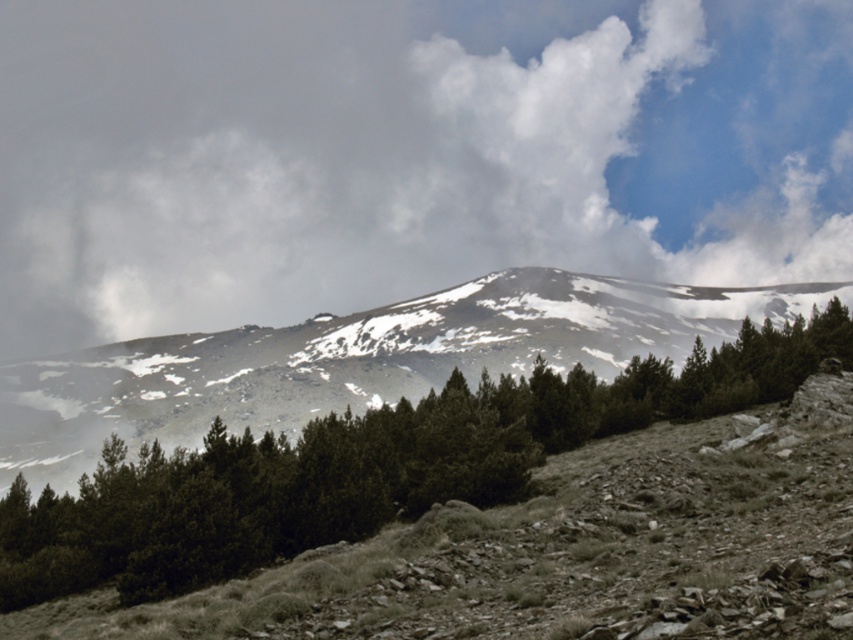
Who is more forward, (254, 196) or (495, 403)?

Positioned in front is point (495, 403).

Who is more distant from viewer, (x=509, y=93) or (x=189, y=544)?

Point (x=509, y=93)

In order to click on white fluffy cloud at upper center in this screenshot , I will do (x=404, y=154).